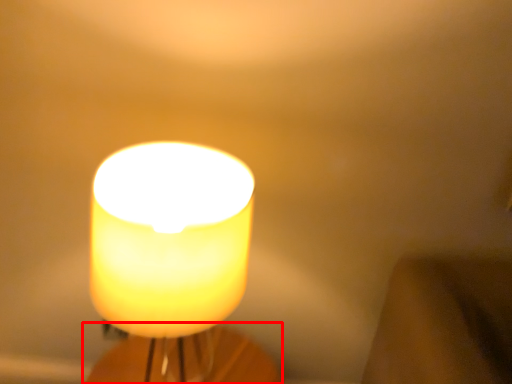
Question: From the image, what is the correct spatial relationship of candle holder (annotated by the red box) in relation to candle?

Choices:
 (A) right
 (B) left

Answer: (B)